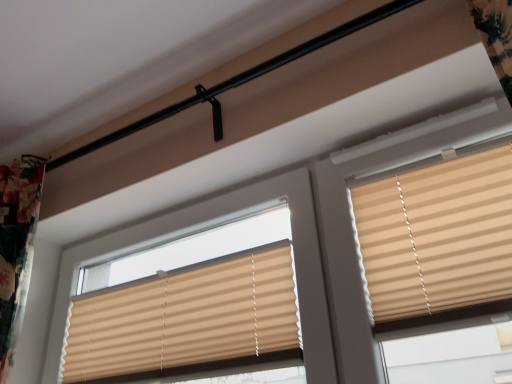
Question: From a real-world perspective, is beige pleated blinds at upper right, acting as the first window blind starting from the right, positioned under beige pleated blind at center, placed as the 2th window blind when sorted from right to left, based on gravity?

Choices:
 (A) no
 (B) yes

Answer: (A)

Question: Is beige pleated blinds at upper right, the second window blind from the left, located outside beige pleated blind at center, marked as the 1th window blind in a left-to-right arrangement?

Choices:
 (A) no
 (B) yes

Answer: (B)

Question: Is beige pleated blinds at upper right, the second window blind from the left, closer to camera compared to beige pleated blind at center, marked as the 1th window blind in a left-to-right arrangement?

Choices:
 (A) no
 (B) yes

Answer: (B)

Question: From the image's perspective, would you say beige pleated blinds at upper right, acting as the first window blind starting from the right, is positioned over beige pleated blind at center, placed as the 2th window blind when sorted from right to left?

Choices:
 (A) no
 (B) yes

Answer: (B)

Question: Is beige pleated blinds at upper right, the second window blind from the left, shorter than beige pleated blind at center, placed as the 2th window blind when sorted from right to left?

Choices:
 (A) no
 (B) yes

Answer: (A)

Question: Is beige pleated blinds at upper right, acting as the first window blind starting from the right, facing away from beige pleated blind at center, placed as the 2th window blind when sorted from right to left?

Choices:
 (A) no
 (B) yes

Answer: (A)

Question: From a real-world perspective, does beige pleated blind at center, placed as the 2th window blind when sorted from right to left, sit lower than beige pleated blinds at upper right, the second window blind from the left?

Choices:
 (A) yes
 (B) no

Answer: (A)

Question: Is beige pleated blind at center, marked as the 1th window blind in a left-to-right arrangement, aimed at beige pleated blinds at upper right, the second window blind from the left?

Choices:
 (A) no
 (B) yes

Answer: (A)

Question: From the image's perspective, does beige pleated blind at center, placed as the 2th window blind when sorted from right to left, appear lower than beige pleated blinds at upper right, acting as the first window blind starting from the right?

Choices:
 (A) no
 (B) yes

Answer: (B)

Question: Does beige pleated blind at center, placed as the 2th window blind when sorted from right to left, contain beige pleated blinds at upper right, the second window blind from the left?

Choices:
 (A) yes
 (B) no

Answer: (B)

Question: Considering the relative positions of beige pleated blind at center, placed as the 2th window blind when sorted from right to left, and beige pleated blinds at upper right, acting as the first window blind starting from the right, in the image provided, is beige pleated blind at center, placed as the 2th window blind when sorted from right to left, to the left of beige pleated blinds at upper right, acting as the first window blind starting from the right, from the viewer's perspective?

Choices:
 (A) yes
 (B) no

Answer: (A)

Question: Considering the relative sizes of beige pleated blind at center, placed as the 2th window blind when sorted from right to left, and beige pleated blinds at upper right, the second window blind from the left, in the image provided, is beige pleated blind at center, placed as the 2th window blind when sorted from right to left, smaller than beige pleated blinds at upper right, the second window blind from the left,?

Choices:
 (A) yes
 (B) no

Answer: (B)

Question: Considering the positions of beige pleated blinds at upper right, the second window blind from the left, and beige pleated blind at center, placed as the 2th window blind when sorted from right to left, in the image, is beige pleated blinds at upper right, the second window blind from the left, wider or thinner than beige pleated blind at center, placed as the 2th window blind when sorted from right to left,?

Choices:
 (A) wide
 (B) thin

Answer: (A)